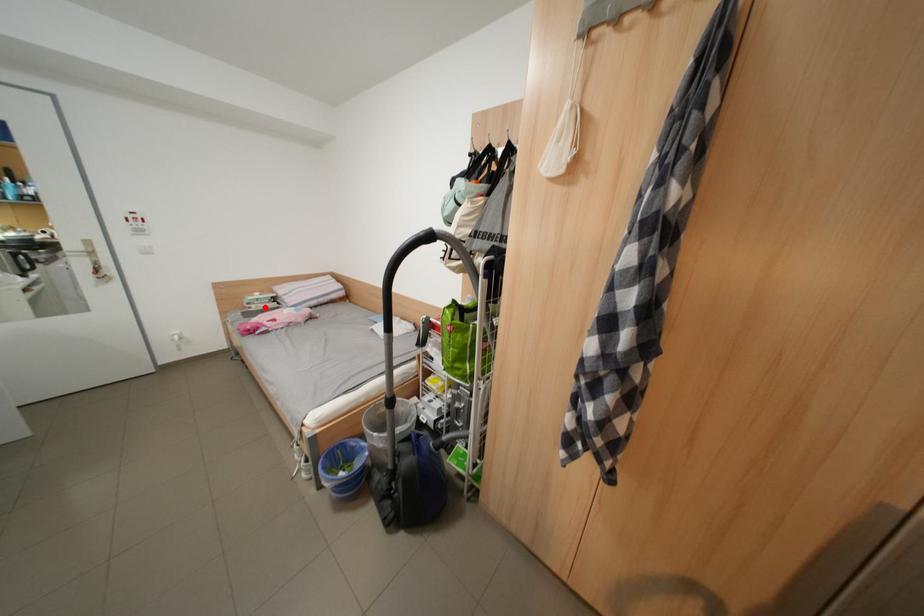
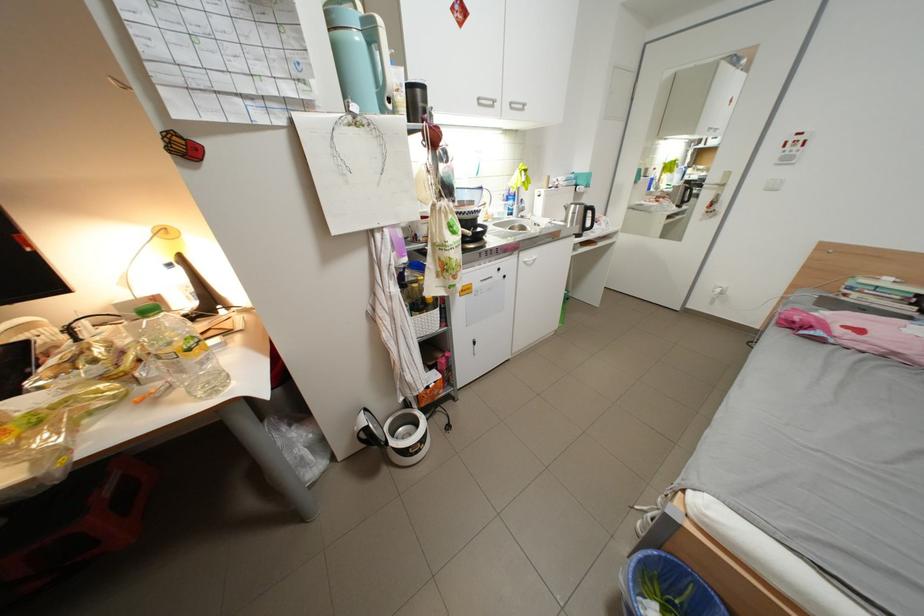
Question: I am providing you with two images of the same scene from different viewpoints. A red point is shown in image1. For the corresponding object point in image2, is it positioned nearer or farther from the camera?

Choices:
 (A) Nearer
 (B) Farther

Answer: (B)